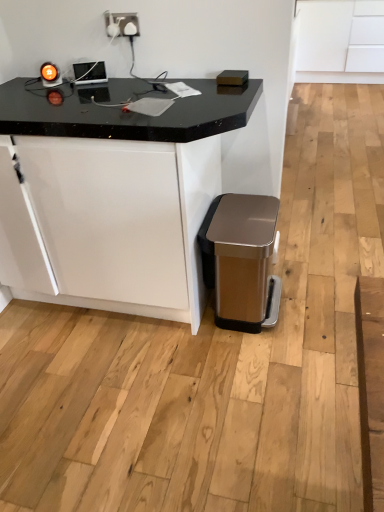
Locate an element on the screen. The image size is (384, 512). blank space above black marble table at center (from a real-world perspective) is located at coordinates (114, 98).